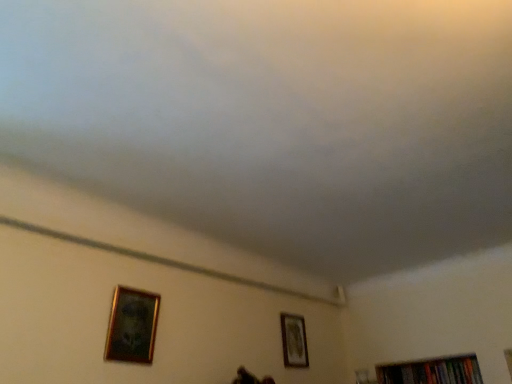
Question: From the image's perspective, is gold-framed picture at lower right, which is the 2th picture frame in top-to-bottom order, located beneath gold-framed picture at lower left, arranged as the first picture frame when viewed from the left?

Choices:
 (A) yes
 (B) no

Answer: (A)

Question: Is gold-framed picture at lower right, positioned as the 1th picture frame in right-to-left order, thinner than gold-framed picture at lower left, arranged as the first picture frame when viewed from the left?

Choices:
 (A) no
 (B) yes

Answer: (B)

Question: From the image's perspective, is gold-framed picture at lower right, the first picture frame positioned from the back, over gold-framed picture at lower left, which is counted as the second picture frame, starting from the back?

Choices:
 (A) yes
 (B) no

Answer: (B)

Question: Does gold-framed picture at lower right, the first picture frame positioned from the back, appear on the left side of gold-framed picture at lower left, which is the 1th picture frame from front to back?

Choices:
 (A) yes
 (B) no

Answer: (B)

Question: Can you confirm if gold-framed picture at lower right, positioned as the 1th picture frame in right-to-left order, is smaller than gold-framed picture at lower left, which appears as the second picture frame when viewed from the right?

Choices:
 (A) no
 (B) yes

Answer: (B)

Question: Is gold-framed picture at lower left, arranged as the first picture frame when viewed from the left, at the back of gold-framed picture at lower right, positioned as the 1th picture frame in right-to-left order?

Choices:
 (A) no
 (B) yes

Answer: (A)

Question: Is hardcover books at bottom right bigger than gold-framed picture at lower left, which is counted as the second picture frame, starting from the back?

Choices:
 (A) no
 (B) yes

Answer: (B)

Question: Can we say hardcover books at bottom right lies outside gold-framed picture at lower left, which ranks as the second picture frame in bottom-to-top order?

Choices:
 (A) yes
 (B) no

Answer: (A)

Question: From the image's perspective, is hardcover books at bottom right beneath gold-framed picture at lower left, which appears as the second picture frame when viewed from the right?

Choices:
 (A) no
 (B) yes

Answer: (B)

Question: From a real-world perspective, is hardcover books at bottom right under gold-framed picture at lower left, which ranks as the second picture frame in bottom-to-top order?

Choices:
 (A) no
 (B) yes

Answer: (B)

Question: Is hardcover books at bottom right smaller than gold-framed picture at lower left, arranged as the first picture frame when viewed from the left?

Choices:
 (A) yes
 (B) no

Answer: (B)

Question: Does hardcover books at bottom right appear on the left side of gold-framed picture at lower left, which ranks as the second picture frame in bottom-to-top order?

Choices:
 (A) yes
 (B) no

Answer: (B)

Question: Is gold-framed picture at lower left, which ranks as the second picture frame in bottom-to-top order, thinner than gold-framed picture at lower right, which is the 2th picture frame in top-to-bottom order?

Choices:
 (A) yes
 (B) no

Answer: (B)